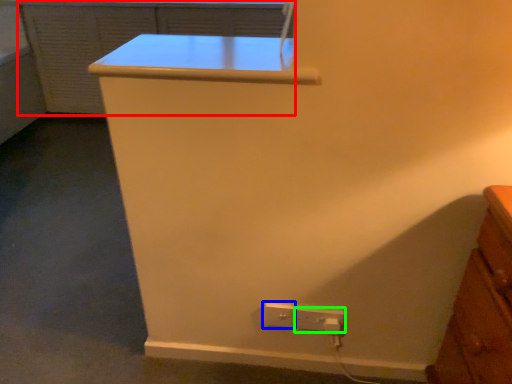
Question: Considering the real-world distances, which object is closest to file cabinet (highlighted by a red box)? power plugs and sockets (highlighted by a blue box) or power plugs and sockets (highlighted by a green box).

Choices:
 (A) power plugs and sockets
 (B) power plugs and sockets

Answer: (A)